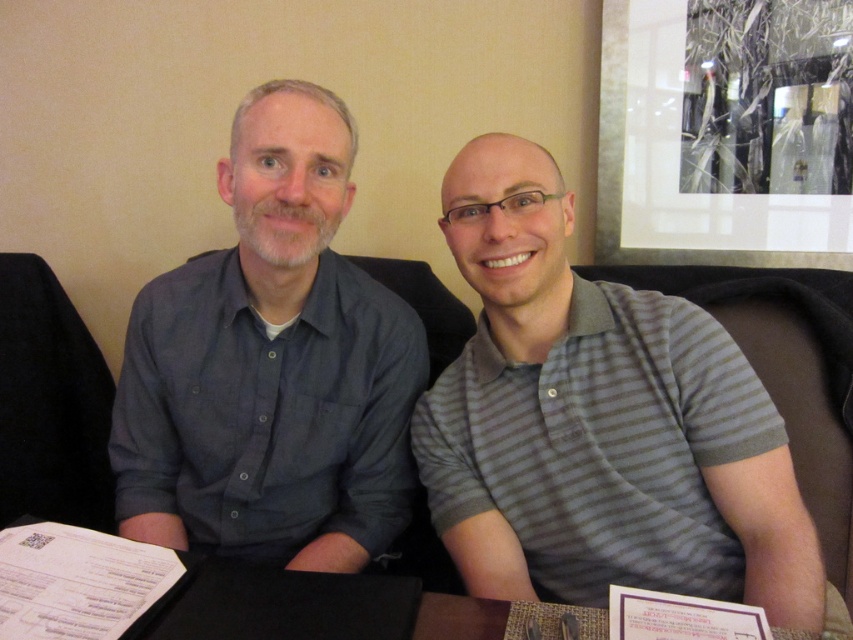
Which of these two, dark blue button-down shirt at left or black leather table at lower center, stands taller?

dark blue button-down shirt at left

In the scene shown: Can you confirm if dark blue button-down shirt at left is positioned to the right of black leather table at lower center?

In fact, dark blue button-down shirt at left is to the left of black leather table at lower center.

Describe the element at coordinates (271, 365) in the screenshot. This screenshot has width=853, height=640. I see `dark blue button-down shirt at left` at that location.

Find the location of a particular element. The image size is (853, 640). dark blue button-down shirt at left is located at coordinates [271, 365].

Is gray striped polo shirt at center to the right of black leather table at lower center from the viewer's perspective?

Indeed, gray striped polo shirt at center is positioned on the right side of black leather table at lower center.

Where is `gray striped polo shirt at center`? This screenshot has height=640, width=853. gray striped polo shirt at center is located at coordinates (283, 193).

Find the location of a particular element. The width and height of the screenshot is (853, 640). gray striped polo shirt at center is located at coordinates click(x=283, y=193).

Does dark blue button-down shirt at left have a lesser height compared to gray striped polo shirt at center?

No, dark blue button-down shirt at left is not shorter than gray striped polo shirt at center.

Is dark blue button-down shirt at left closer to the viewer compared to gray striped polo shirt at center?

No.

Does point (247, 451) come in front of point (312, 225)?

No, (247, 451) is further to viewer.

Where is `dark blue button-down shirt at left`? dark blue button-down shirt at left is located at coordinates (271, 365).